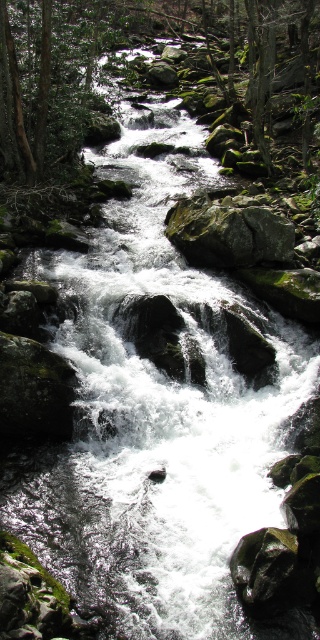
Question: Can you confirm if green mossy rocks at center is positioned below green mossy rock at center?

Choices:
 (A) no
 (B) yes

Answer: (A)

Question: Can you confirm if green mossy rocks at center is positioned to the right of green mossy rock at center?

Choices:
 (A) yes
 (B) no

Answer: (A)

Question: Can you confirm if green mossy rocks at center is smaller than green mossy rock at center?

Choices:
 (A) yes
 (B) no

Answer: (B)

Question: Which object is farther from the camera taking this photo?

Choices:
 (A) green mossy rock at center
 (B) green mossy rocks at center

Answer: (B)